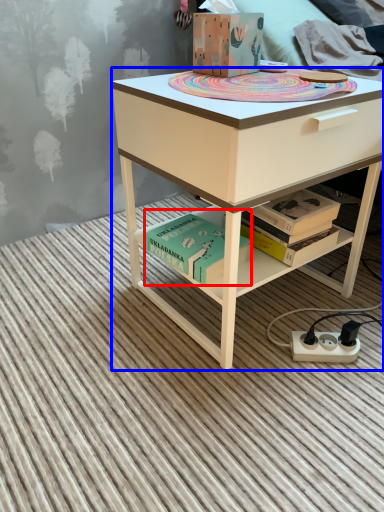
Question: Which object is closer to the camera taking this photo, book (highlighted by a red box) or desk (highlighted by a blue box)?

Choices:
 (A) book
 (B) desk

Answer: (B)